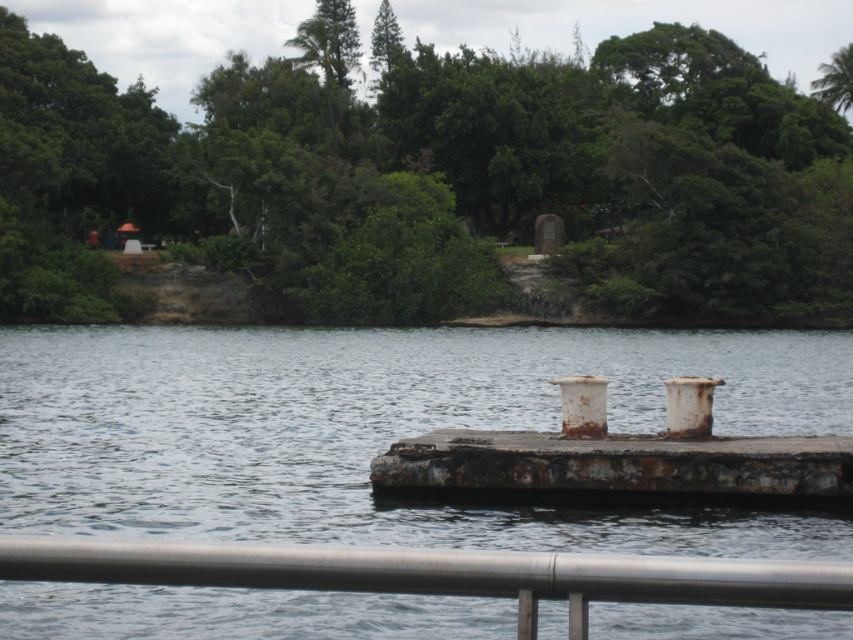
Between rusty metallic water at center and rusty metal dock at center, which one has less height?

rusty metal dock at center is shorter.

Is point (434, 636) closer to camera compared to point (585, 429)?

That is True.

The image size is (853, 640). Identify the location of rusty metallic water at center. (379, 429).

Is point (775, 225) positioned in front of point (757, 442)?

That is False.

Does green leafy tree at upper center have a lesser height compared to rusty metal dock at center?

Incorrect, green leafy tree at upper center's height does not fall short of rusty metal dock at center's.

Between point (12, 230) and point (589, 394), which one is positioned behind?

The point (12, 230) is behind.

At what (x,y) coordinates should I click in order to perform the action: click on green leafy tree at upper center. Please return your answer as a coordinate pair (x, y). The width and height of the screenshot is (853, 640). Looking at the image, I should click on (434, 179).

Between green leafy tree at upper center and silver metallic rail at lower center, which one appears on the right side from the viewer's perspective?

From the viewer's perspective, green leafy tree at upper center appears more on the right side.

In the scene shown: Does green leafy tree at upper center come behind silver metallic rail at lower center?

Yes, green leafy tree at upper center is behind silver metallic rail at lower center.

Is point (782, 262) in front of point (651, 595)?

That is False.

Find the location of a particular element. The height and width of the screenshot is (640, 853). green leafy tree at upper center is located at coordinates (434, 179).